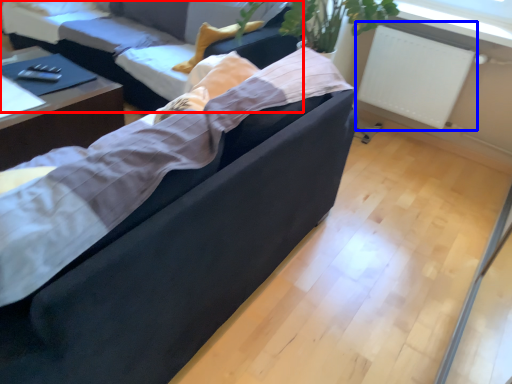
Question: Which object appears closest to the camera in this image, studio couch (highlighted by a red box) or radiator (highlighted by a blue box)?

Choices:
 (A) studio couch
 (B) radiator

Answer: (A)